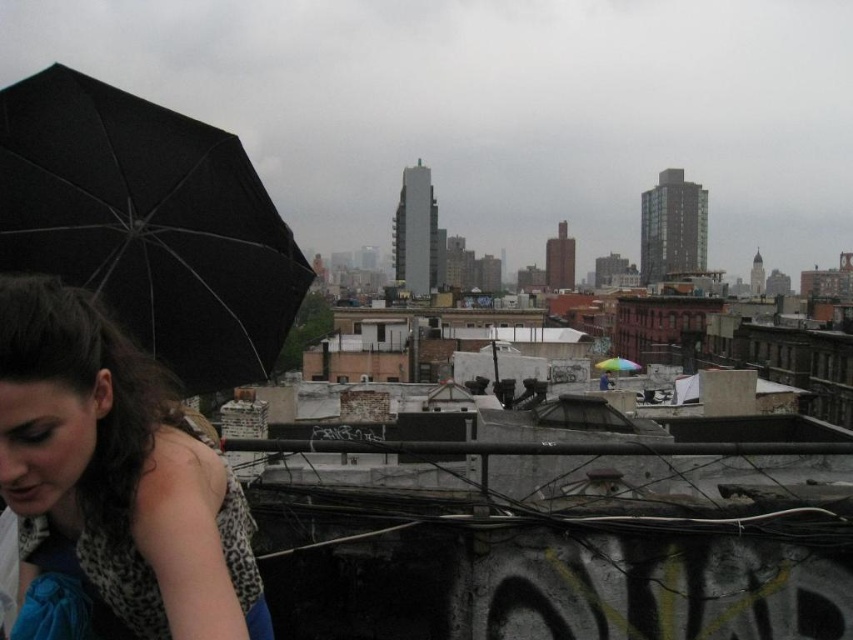
Question: Which object is closer to the camera taking this photo?

Choices:
 (A) matte black umbrella at left
 (B) black matte umbrella at left
 (C) rainbow fabric umbrella at center

Answer: (A)

Question: Can you confirm if black matte umbrella at left is bigger than rainbow fabric umbrella at center?

Choices:
 (A) no
 (B) yes

Answer: (A)

Question: Based on their relative distances, which object is nearer to the matte black umbrella at left?

Choices:
 (A) rainbow fabric umbrella at center
 (B) black matte umbrella at left

Answer: (B)

Question: Estimate the real-world distances between objects in this image. Which object is farther from the matte black umbrella at left?

Choices:
 (A) black matte umbrella at left
 (B) rainbow fabric umbrella at center

Answer: (B)

Question: Is matte black umbrella at left bigger than rainbow fabric umbrella at center?

Choices:
 (A) yes
 (B) no

Answer: (B)

Question: From the image, what is the correct spatial relationship of black matte umbrella at left in relation to matte black umbrella at left?

Choices:
 (A) below
 (B) above

Answer: (B)